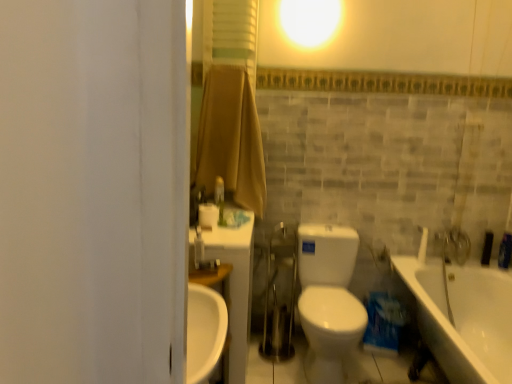
What do you see at coordinates (208, 215) in the screenshot? The width and height of the screenshot is (512, 384). I see `white matte toilet paper at center` at bounding box center [208, 215].

Describe the element at coordinates (231, 105) in the screenshot. The image size is (512, 384). I see `brown fabric shower curtain at upper center` at that location.

Where is `white glossy bathtub at lower right`? The image size is (512, 384). white glossy bathtub at lower right is located at coordinates (463, 318).

You are a GUI agent. You are given a task and a screenshot of the screen. Output one action in this format:
    pyautogui.click(x=<x>, y=<y>)
    Task: Click on the fixture on the left of the brown fabric shower curtain at upper center
    The height and width of the screenshot is (384, 512).
    Given the screenshot: What is the action you would take?
    pyautogui.click(x=199, y=249)

Between white plastic faucet at upper left and brown fabric shower curtain at upper center, which one appears on the right side from the viewer's perspective?

brown fabric shower curtain at upper center.

From the image's perspective, is white plastic faucet at upper left positioned above or below brown fabric shower curtain at upper center?

white plastic faucet at upper left is below brown fabric shower curtain at upper center.

Is point (197, 265) in front of point (236, 104)?

That is True.

Is white plastic faucet at upper left surrounded by white glossy bathtub at lower right?

No, white plastic faucet at upper left is located outside of white glossy bathtub at lower right.

Can you confirm if white glossy bathtub at lower right is thinner than white plastic faucet at upper left?

In fact, white glossy bathtub at lower right might be wider than white plastic faucet at upper left.

From a real-world perspective, does white glossy bathtub at lower right sit lower than white plastic faucet at upper left?

Yes.

Are white glossy toilet at center and white glossy faucet at upper right making contact?

No, white glossy toilet at center is not making contact with white glossy faucet at upper right.

This screenshot has height=384, width=512. I want to click on toilet that is under the white glossy faucet at upper right (from a real-world perspective), so click(x=328, y=299).

Does point (334, 335) come behind point (419, 231)?

No, it is in front of (419, 231).

Which object is further away from the camera, white glossy toilet at center or white glossy faucet at upper right?

Positioned behind is white glossy faucet at upper right.

Considering the positions of objects brown fabric shower curtain at upper center and white glossy toilet at center in the image provided, who is more to the left, brown fabric shower curtain at upper center or white glossy toilet at center?

brown fabric shower curtain at upper center.

Is brown fabric shower curtain at upper center turned away from white glossy toilet at center?

No, brown fabric shower curtain at upper center is not facing away from white glossy toilet at center.

Between point (208, 27) and point (324, 360), which one is positioned behind?

Point (324, 360)

Who is taller, brown fabric shower curtain at upper center or white glossy toilet at center?

Standing taller between the two is brown fabric shower curtain at upper center.

Could you tell me if white glossy toilet at center is facing white plastic faucet at upper left?

No.

Does point (302, 238) come in front of point (202, 245)?

No, it is not.

You are a GUI agent. You are given a task and a screenshot of the screen. Output one action in this format:
    pyautogui.click(x=<x>, y=<y>)
    Task: Click on the fixture above the white glossy toilet at center (from the image's perspective)
    The height and width of the screenshot is (384, 512).
    Given the screenshot: What is the action you would take?
    pyautogui.click(x=199, y=249)

Who is bigger, white glossy faucet at upper right or brown fabric shower curtain at upper center?

With larger size is brown fabric shower curtain at upper center.

Is white glossy faucet at upper right positioned with its back to brown fabric shower curtain at upper center?

That's not correct — white glossy faucet at upper right is not looking away from brown fabric shower curtain at upper center.

Measure the distance from white glossy faucet at upper right to brown fabric shower curtain at upper center.

They are 1.37 meters apart.

Where is `shower curtain that is above the white glossy faucet at upper right (from a real-world perspective)`? The width and height of the screenshot is (512, 384). shower curtain that is above the white glossy faucet at upper right (from a real-world perspective) is located at coordinates (231, 105).

Who is taller, white glossy bathtub at lower right or white matte toilet paper at center?

white glossy bathtub at lower right is taller.

Which of these two, white glossy bathtub at lower right or white matte toilet paper at center, is thinner?

With smaller width is white matte toilet paper at center.

Is white glossy bathtub at lower right not near white matte toilet paper at center?

white glossy bathtub at lower right is positioned a significant distance from white matte toilet paper at center.

Looking at the image, does white glossy bathtub at lower right seem bigger or smaller compared to white matte toilet paper at center?

Clearly, white glossy bathtub at lower right is larger in size than white matte toilet paper at center.

You are a GUI agent. You are given a task and a screenshot of the screen. Output one action in this format:
    pyautogui.click(x=<x>, y=<y>)
    Task: Click on the shower curtain on the right of the white plastic faucet at upper left
    The height and width of the screenshot is (384, 512).
    Given the screenshot: What is the action you would take?
    pos(231,105)

The height and width of the screenshot is (384, 512). I want to click on fixture that is behind the white glossy bathtub at lower right, so click(199, 249).

Looking at the image, which one is located closer to white glossy faucet at upper right, brown fabric shower curtain at upper center or white glossy bathtub at lower right?

The object closer to white glossy faucet at upper right is white glossy bathtub at lower right.

Looking at the image, which one is located closer to white matte toilet paper at center, white plastic faucet at upper left or white glossy toilet at center?

white plastic faucet at upper left is closer to white matte toilet paper at center.

Estimate the real-world distances between objects in this image. Which object is further from white glossy bathtub at lower right, white plastic faucet at upper left or white matte toilet paper at center?

white plastic faucet at upper left.

Based on their spatial positions, is white matte toilet paper at center or white plastic faucet at upper left closer to brown fabric shower curtain at upper center?

Based on the image, white matte toilet paper at center appears to be nearer to brown fabric shower curtain at upper center.

Considering their positions, is brown fabric shower curtain at upper center positioned further to white plastic faucet at upper left than white matte toilet paper at center?

brown fabric shower curtain at upper center.

From the picture: Which object lies further to the anchor point brown fabric shower curtain at upper center, white glossy toilet at center or white matte toilet paper at center?

white glossy toilet at center lies further to brown fabric shower curtain at upper center than the other object.

When comparing their distances from white matte toilet paper at center, does white glossy bathtub at lower right or white plastic faucet at upper left seem further?

Among the two, white glossy bathtub at lower right is located further to white matte toilet paper at center.

Estimate the real-world distances between objects in this image. Which object is further from white glossy bathtub at lower right, white glossy faucet at upper right or brown fabric shower curtain at upper center?

The object further to white glossy bathtub at lower right is brown fabric shower curtain at upper center.

Locate an element on the screen. This screenshot has width=512, height=384. toilet between brown fabric shower curtain at upper center and white glossy faucet at upper right is located at coordinates (328, 299).

Find the location of a particular element. shower curtain located between white plastic faucet at upper left and white glossy faucet at upper right in the left-right direction is located at coordinates (231, 105).

This screenshot has width=512, height=384. Identify the location of toilet paper that lies between brown fabric shower curtain at upper center and white glossy toilet at center from top to bottom. (208, 215).

Find the location of `shower curtain located between white matte toilet paper at center and white glossy bathtub at lower right in the left-right direction`. shower curtain located between white matte toilet paper at center and white glossy bathtub at lower right in the left-right direction is located at coordinates (231, 105).